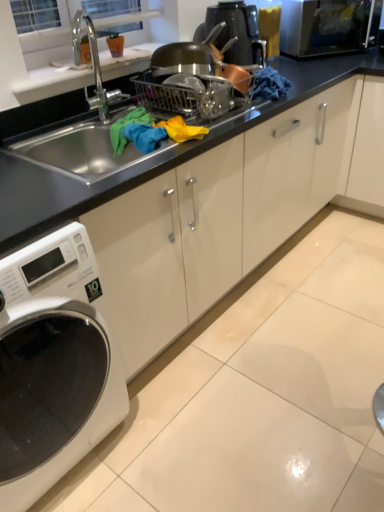
Identify the location of white glossy washing machine at lower left. This screenshot has height=512, width=384. (53, 365).

You are a GUI agent. You are given a task and a screenshot of the screen. Output one action in this format:
    pyautogui.click(x=<x>, y=<y>)
    Task: Click on the black glass microwave at upper right
    
    Given the screenshot: What is the action you would take?
    pyautogui.click(x=327, y=26)

What is the approximate width of black glass microwave at upper right?

black glass microwave at upper right is 11.86 inches in width.

This screenshot has height=512, width=384. What are the coordinates of `black glossy coffee machine at upper center` in the screenshot? It's located at (237, 32).

You are a GUI agent. You are given a task and a screenshot of the screen. Output one action in this format:
    pyautogui.click(x=<x>, y=<y>)
    Task: Click on the white glossy washing machine at lower left
    Image resolution: width=384 pixels, height=512 pixels.
    Given the screenshot: What is the action you would take?
    pyautogui.click(x=53, y=365)

Could you tell me if black matte sink at center is facing white glossy washing machine at lower left?

No, black matte sink at center is not oriented towards white glossy washing machine at lower left.

In the image, is black matte sink at center on the left side or the right side of white glossy washing machine at lower left?

black matte sink at center is to the right of white glossy washing machine at lower left.

In the image, there is a white glossy washing machine at lower left. Identify the location of countertop above it (from the image's perspective). This screenshot has width=384, height=512. 140,162.

Which object is thinner, black glass microwave at upper right or white glossy washing machine at lower left?

With smaller width is black glass microwave at upper right.

Would you say black glass microwave at upper right is inside or outside white glossy washing machine at lower left?

black glass microwave at upper right is not inside white glossy washing machine at lower left, it's outside.

Is black glass microwave at upper right at the right side of white glossy washing machine at lower left?

Yes.

Measure the distance from black glass microwave at upper right to white glossy washing machine at lower left.

They are 2.08 meters apart.

Is black matte sink at center not within black glass microwave at upper right?

black matte sink at center is positioned outside black glass microwave at upper right.

Considering the relative sizes of black matte sink at center and black glass microwave at upper right in the image provided, is black matte sink at center taller than black glass microwave at upper right?

Indeed, black matte sink at center has a greater height compared to black glass microwave at upper right.

Looking at this image, can you confirm if black matte sink at center is positioned to the left of black glass microwave at upper right?

Yes.

At what (x,y) coordinates should I click in order to perform the action: click on countertop in front of the black glass microwave at upper right. Please return your answer as a coordinate pair (x, y). The width and height of the screenshot is (384, 512). Looking at the image, I should click on (140, 162).

Which is correct: black glossy coffee machine at upper center is inside black glass microwave at upper right, or outside of it?

black glossy coffee machine at upper center cannot be found inside black glass microwave at upper right.

Is point (254, 50) behind point (298, 37)?

That is False.

Does black glossy coffee machine at upper center have a larger size compared to black glass microwave at upper right?

Actually, black glossy coffee machine at upper center might be smaller than black glass microwave at upper right.

Between point (259, 42) and point (32, 259), which one is positioned behind?

The point (259, 42) is farther.

Is black glossy coffee machine at upper center facing away from white glossy washing machine at lower left?

No, white glossy washing machine at lower left is not at the back of black glossy coffee machine at upper center.

Considering the positions of objects black glossy coffee machine at upper center and white glossy washing machine at lower left in the image provided, who is more to the right, black glossy coffee machine at upper center or white glossy washing machine at lower left?

black glossy coffee machine at upper center is more to the right.

Which of these two, black glossy coffee machine at upper center or white glossy washing machine at lower left, is thinner?

With smaller width is black glossy coffee machine at upper center.

From a real-world perspective, which object stands above the other?

black glass microwave at upper right, from a real-world perspective.

Is point (93, 350) farther from camera compared to point (375, 5)?

No, it is not.

From the picture: Are white glossy washing machine at lower left and black glass microwave at upper right beside each other?

No, white glossy washing machine at lower left is not beside black glass microwave at upper right.

Which object is positioned more to the right, white glossy washing machine at lower left or black glass microwave at upper right?

From the viewer's perspective, black glass microwave at upper right appears more on the right side.

What are the coordinates of `countertop lying below the black glass microwave at upper right (from the image's perspective)` in the screenshot? It's located at (140, 162).

Considering the relative sizes of black glass microwave at upper right and black matte sink at center in the image provided, is black glass microwave at upper right shorter than black matte sink at center?

Yes.

Which is behind, point (353, 15) or point (75, 200)?

Point (353, 15)

Locate an element on the screen. This screenshot has width=384, height=512. countertop above the white glossy washing machine at lower left (from a real-world perspective) is located at coordinates tap(140, 162).

Where is `microwave oven above the white glossy washing machine at lower left (from the image's perspective)`? microwave oven above the white glossy washing machine at lower left (from the image's perspective) is located at coordinates (327, 26).

Which object lies further to the anchor point black matte sink at center, black glossy coffee machine at upper center or black glass microwave at upper right?

black glossy coffee machine at upper center is positioned further to the anchor black matte sink at center.

When comparing their distances from black matte sink at center, does black glass microwave at upper right or black glossy coffee machine at upper center seem further?

The object further to black matte sink at center is black glossy coffee machine at upper center.

Based on the photo, considering their positions, is white glossy washing machine at lower left positioned further to black glass microwave at upper right than black matte sink at center?

white glossy washing machine at lower left lies further to black glass microwave at upper right than the other object.

From the image, which object appears to be nearer to black glass microwave at upper right, black glossy coffee machine at upper center or white glossy washing machine at lower left?

black glossy coffee machine at upper center.

Which object lies further to the anchor point white glossy washing machine at lower left, black glossy coffee machine at upper center or black matte sink at center?

Based on the image, black glossy coffee machine at upper center appears to be further to white glossy washing machine at lower left.

Looking at the image, which one is located further to black glossy coffee machine at upper center, white glossy washing machine at lower left or black glass microwave at upper right?

white glossy washing machine at lower left lies further to black glossy coffee machine at upper center than the other object.

Based on their spatial positions, is black matte sink at center or white glossy washing machine at lower left closer to black glossy coffee machine at upper center?

black matte sink at center lies closer to black glossy coffee machine at upper center than the other object.

Looking at this image, based on their spatial positions, is black glass microwave at upper right or black glossy coffee machine at upper center further from white glossy washing machine at lower left?

black glass microwave at upper right is positioned further to the anchor white glossy washing machine at lower left.

Find the location of a particular element. The height and width of the screenshot is (512, 384). coffee machine between black glass microwave at upper right and white glossy washing machine at lower left in the up-down direction is located at coordinates click(x=237, y=32).

The height and width of the screenshot is (512, 384). I want to click on countertop between black glass microwave at upper right and white glossy washing machine at lower left vertically, so click(x=140, y=162).

Where is `countertop that lies between black glossy coffee machine at upper center and white glossy washing machine at lower left from top to bottom`? The width and height of the screenshot is (384, 512). countertop that lies between black glossy coffee machine at upper center and white glossy washing machine at lower left from top to bottom is located at coordinates (140, 162).

Locate an element on the screen. coffee machine located between black matte sink at center and black glass microwave at upper right in the depth direction is located at coordinates point(237,32).